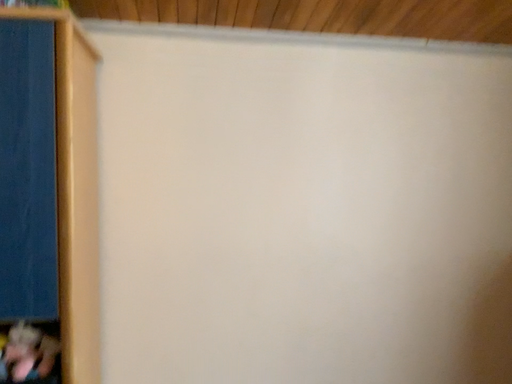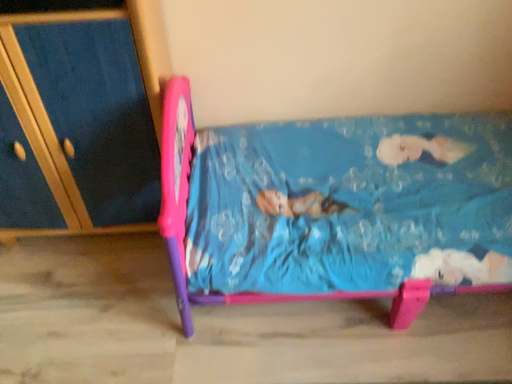
Question: Which way did the camera rotate in the video?

Choices:
 (A) rotated downward
 (B) rotated upward

Answer: (A)